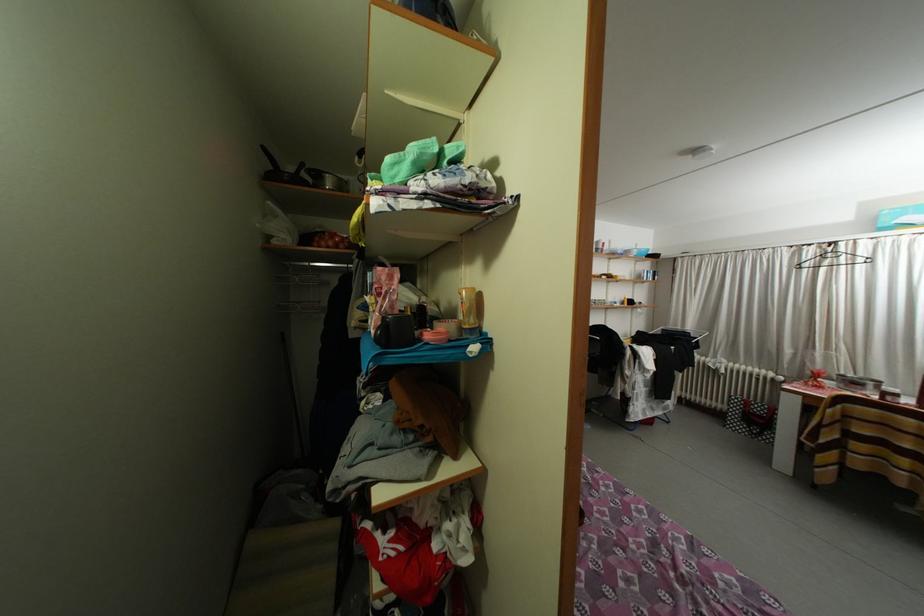
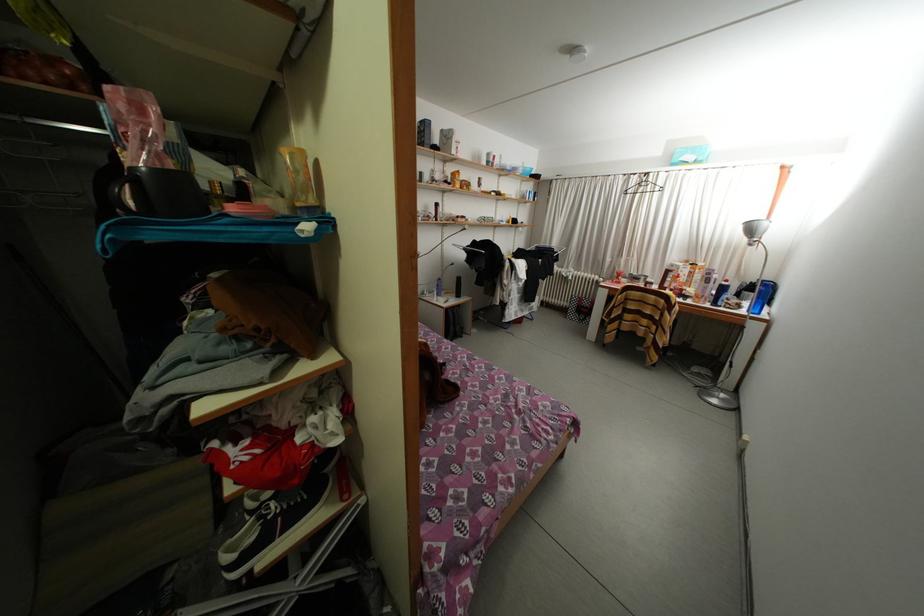
Locate, in the second image, the point that corresponds to [349,252] in the first image.

(91, 92)